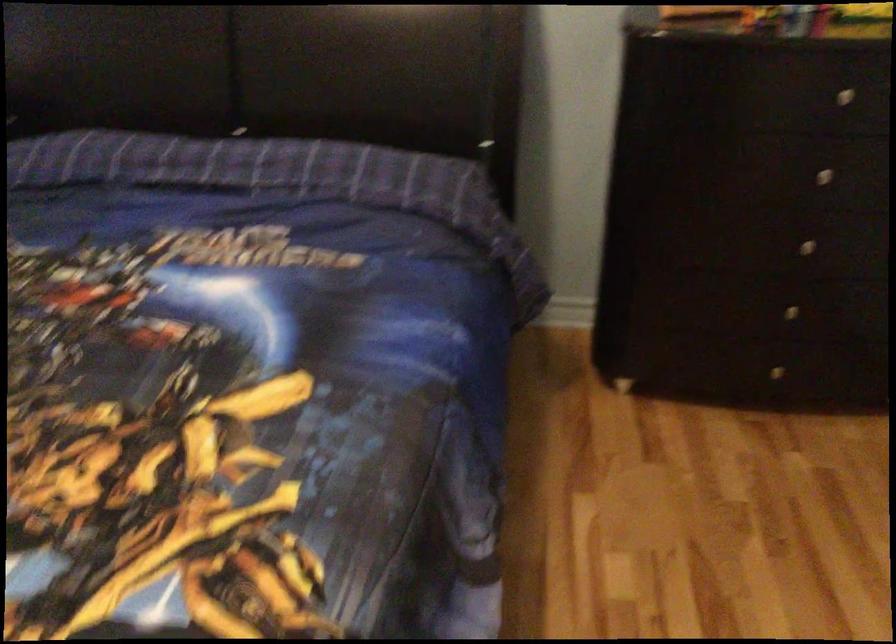
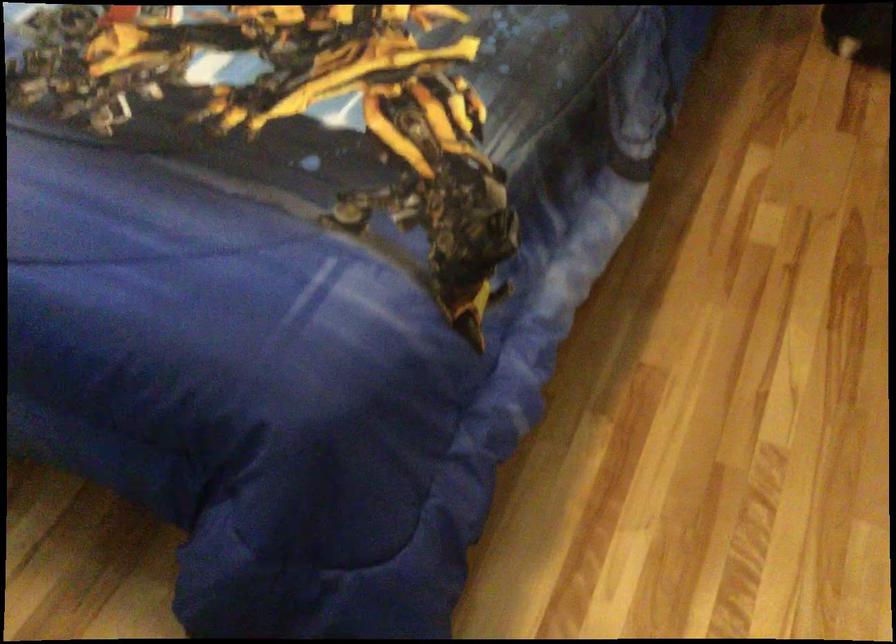
Question: How did the camera likely rotate?

Choices:
 (A) Left
 (B) Right
 (C) Up
 (D) Down

Answer: (D)